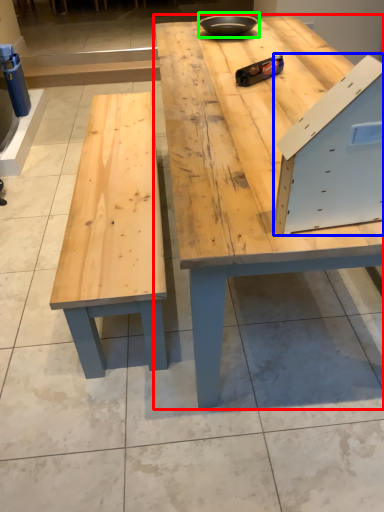
Question: Estimate the real-world distances between objects in this image. Which object is closer to table (highlighted by a red box), drawer (highlighted by a blue box) or bowl (highlighted by a green box)?

Choices:
 (A) drawer
 (B) bowl

Answer: (A)